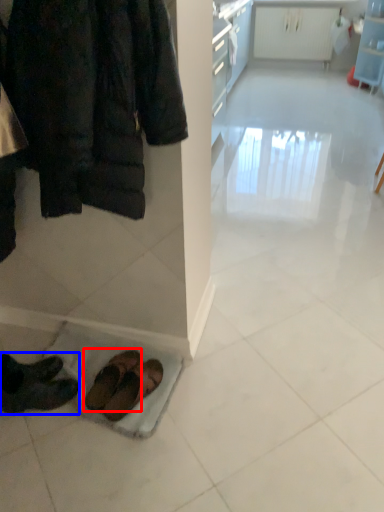
Question: Among these objects, which one is farthest to the camera, footwear (highlighted by a red box) or footwear (highlighted by a blue box)?

Choices:
 (A) footwear
 (B) footwear

Answer: (A)